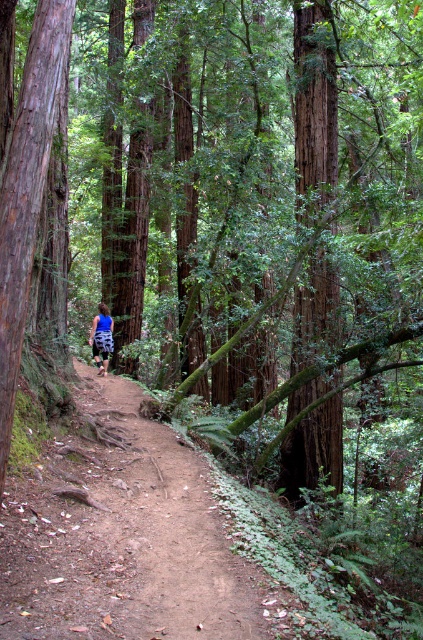
Looking at this image, who is shorter, dirt path at center or blue printed shorts at center?

dirt path at center

Where is `dirt path at center`? dirt path at center is located at coordinates (167, 532).

At what (x,y) coordinates should I click in order to perform the action: click on dirt path at center. Please return your answer as a coordinate pair (x, y). Looking at the image, I should click on (167, 532).